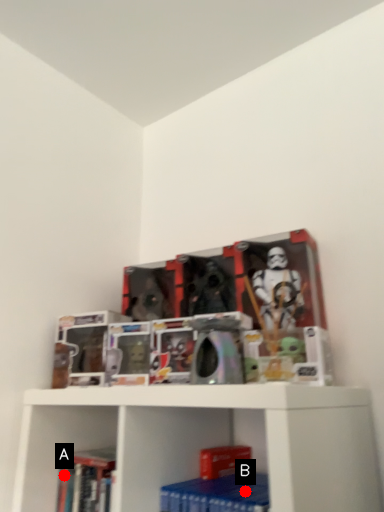
Question: Two points are circled on the image, labeled by A and B beside each circle. Which point appears farthest from the camera in this image?

Choices:
 (A) A is further
 (B) B is further

Answer: (A)